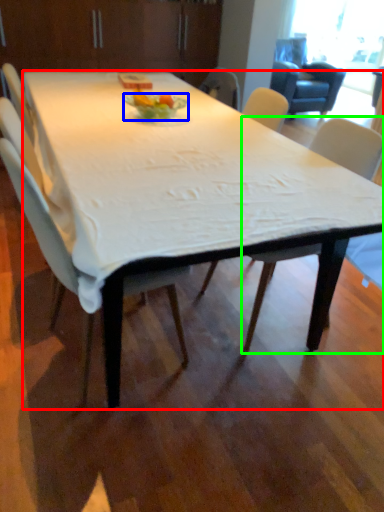
Question: Estimate the real-world distances between objects in this image. Which object is closer to desk (highlighted by a red box), plate (highlighted by a blue box) or chair (highlighted by a green box)?

Choices:
 (A) plate
 (B) chair

Answer: (B)